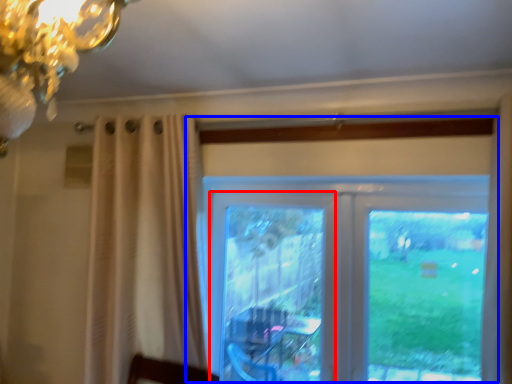
Question: Which of the following is the closest to the observer, screen door (highlighted by a red box) or window (highlighted by a blue box)?

Choices:
 (A) screen door
 (B) window

Answer: (B)